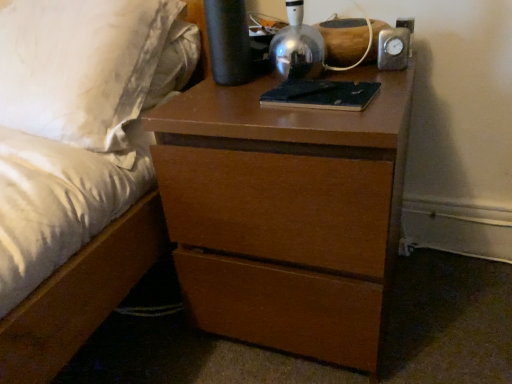
Describe the element at coordinates (79, 296) in the screenshot. I see `matte brown bed at center` at that location.

From the picture: What is the approximate width of dark blue leather book at center?

It is 5.03 inches.

At what (x,y) coordinates should I click in order to perform the action: click on brown wood chest of drawers at center. Please return your answer as a coordinate pair (x, y). Looking at the image, I should click on (285, 213).

Which object is closer to the camera, brown wood chest of drawers at center or matte brown bed at center?

Positioned in front is brown wood chest of drawers at center.

Based on the photo, is brown wood chest of drawers at center to the left of matte brown bed at center from the viewer's perspective?

In fact, brown wood chest of drawers at center is to the right of matte brown bed at center.

Which is in front, point (381, 294) or point (63, 279)?

The point (63, 279) is in front.

This screenshot has width=512, height=384. Identify the location of bed on the left of brown wood chest of drawers at center. (79, 296).

Is there a large distance between brown wood chest of drawers at center and dark blue leather book at center?

brown wood chest of drawers at center is actually quite close to dark blue leather book at center.

Is brown wood chest of drawers at center turned away from dark blue leather book at center?

No, brown wood chest of drawers at center is not facing away from dark blue leather book at center.

From the image's perspective, is brown wood chest of drawers at center located beneath dark blue leather book at center?

Yes, from the image's perspective, brown wood chest of drawers at center is beneath dark blue leather book at center.

Is matte brown bed at center next to dark blue leather book at center?

matte brown bed at center and dark blue leather book at center are not in contact.

Is matte brown bed at center not inside dark blue leather book at center?

Yes, matte brown bed at center is outside of dark blue leather book at center.

Is matte brown bed at center facing away from dark blue leather book at center?

No.

From their relative heights in the image, would you say metallic dome at upper center is taller or shorter than dark blue leather book at center?

Clearly, metallic dome at upper center is taller compared to dark blue leather book at center.

Based on their positions, is metallic dome at upper center located to the left or right of dark blue leather book at center?

In the image, metallic dome at upper center appears on the left side of dark blue leather book at center.

Looking at this image, from a real-world perspective, is metallic dome at upper center beneath dark blue leather book at center?

No, from a real-world perspective, metallic dome at upper center is not beneath dark blue leather book at center.

Is metallic dome at upper center inside matte brown bed at center?

No, matte brown bed at center does not contain metallic dome at upper center.

Does point (78, 271) come in front of point (275, 46)?

Yes.

Find the location of `bed in front of the metallic dome at upper center`. bed in front of the metallic dome at upper center is located at coordinates (79, 296).

Who is bigger, matte brown bed at center or metallic dome at upper center?

With larger size is matte brown bed at center.

From the image's perspective, who appears lower, dark blue leather book at center or matte brown bed at center?

From the image's view, dark blue leather book at center is below.

Which object is positioned more to the left, dark blue leather book at center or matte brown bed at center?

matte brown bed at center is more to the left.

Is dark blue leather book at center surrounding matte brown bed at center?

No, matte brown bed at center is not surrounded by dark blue leather book at center.

Is dark blue leather book at center wider than metallic dome at upper center?

Correct, the width of dark blue leather book at center exceeds that of metallic dome at upper center.

From a real-world perspective, is dark blue leather book at center beneath metallic dome at upper center?

Indeed, from a real-world perspective, dark blue leather book at center is positioned beneath metallic dome at upper center.

There is a dark blue leather book at center. Where is `bedside lamp above it (from a real-world perspective)`? bedside lamp above it (from a real-world perspective) is located at coordinates (297, 46).

At what (x,y) coordinates should I click in order to perform the action: click on bed behind the brown wood chest of drawers at center. Please return your answer as a coordinate pair (x, y). The width and height of the screenshot is (512, 384). Looking at the image, I should click on (79, 296).

You are a GUI agent. You are given a task and a screenshot of the screen. Output one action in this format:
    pyautogui.click(x=<x>, y=<y>)
    Task: Click on the chest of drawers located on the right of dark blue leather book at center
    
    Given the screenshot: What is the action you would take?
    pyautogui.click(x=285, y=213)

Based on their spatial positions, is matte brown bed at center or brown wood chest of drawers at center further from metallic dome at upper center?

Among the two, matte brown bed at center is located further to metallic dome at upper center.

Estimate the real-world distances between objects in this image. Which object is further from matte brown bed at center, metallic dome at upper center or brown wood chest of drawers at center?

metallic dome at upper center is positioned further to the anchor matte brown bed at center.

Looking at the image, which one is located closer to dark blue leather book at center, brown wood chest of drawers at center or matte brown bed at center?

brown wood chest of drawers at center is positioned closer to the anchor dark blue leather book at center.

Which object lies nearer to the anchor point matte brown bed at center, brown wood chest of drawers at center or metallic dome at upper center?

Among the two, brown wood chest of drawers at center is located nearer to matte brown bed at center.

Based on their spatial positions, is dark blue leather book at center or matte brown bed at center closer to brown wood chest of drawers at center?

dark blue leather book at center is closer to brown wood chest of drawers at center.

In the scene shown: From the image, which object appears to be nearer to brown wood chest of drawers at center, matte brown bed at center or dark blue leather book at center?

dark blue leather book at center is closer to brown wood chest of drawers at center.

When comparing their distances from metallic dome at upper center, does matte brown bed at center or dark blue leather book at center seem further?

matte brown bed at center lies further to metallic dome at upper center than the other object.

When comparing their distances from brown wood chest of drawers at center, does metallic dome at upper center or matte brown bed at center seem further?

metallic dome at upper center.

Identify the location of bedside lamp located between matte brown bed at center and dark blue leather book at center in the left-right direction. (297, 46).

What are the coordinates of `bedside lamp located between matte brown bed at center and brown wood chest of drawers at center in the left-right direction` in the screenshot? It's located at (297, 46).

What are the coordinates of `book located between matte brown bed at center and brown wood chest of drawers at center in the left-right direction` in the screenshot? It's located at (322, 95).

This screenshot has width=512, height=384. Identify the location of book between metallic dome at upper center and brown wood chest of drawers at center vertically. (322, 95).